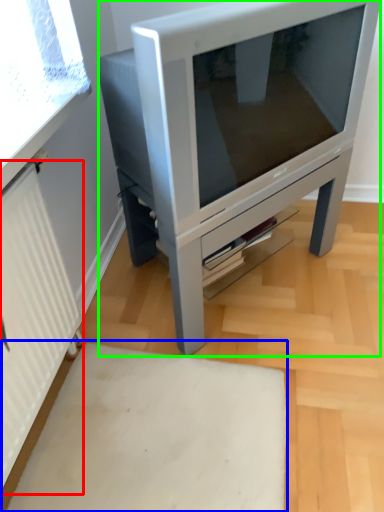
Question: Based on their relative distances, which object is farther from radiator (highlighted by a red box)? Choose from plain (highlighted by a blue box) and furniture (highlighted by a green box).

Choices:
 (A) plain
 (B) furniture

Answer: (B)